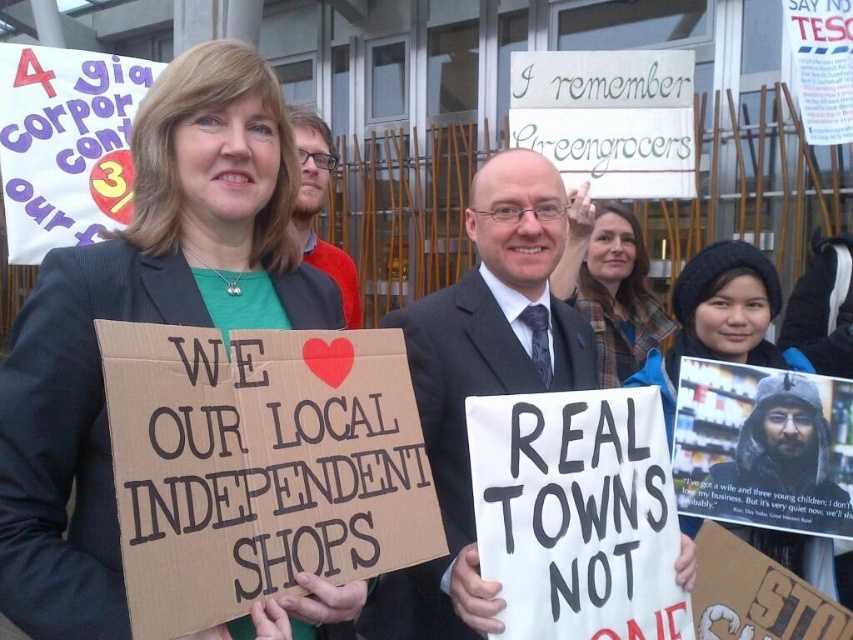
Question: Does matte black blazer at center lie in front of plaid wool scarf at center?

Choices:
 (A) yes
 (B) no

Answer: (A)

Question: Which point appears closest to the camera in this image?

Choices:
 (A) (55, 528)
 (B) (439, 470)

Answer: (A)

Question: Which of the following is the closest to the observer?

Choices:
 (A) tap(670, 323)
 (B) tap(311, 129)
 (C) tap(699, 284)
 (D) tap(437, 634)

Answer: (D)

Question: From the image, what is the correct spatial relationship of blue knit hat at upper right in relation to bearded man with glasses at center?

Choices:
 (A) right
 (B) left

Answer: (A)

Question: Estimate the real-world distances between objects in this image. Which object is farther from the dark gray suit at center?

Choices:
 (A) plaid wool scarf at center
 (B) blue knit hat at upper right

Answer: (A)

Question: Is dark gray suit at center bigger than bearded man with glasses at center?

Choices:
 (A) yes
 (B) no

Answer: (A)